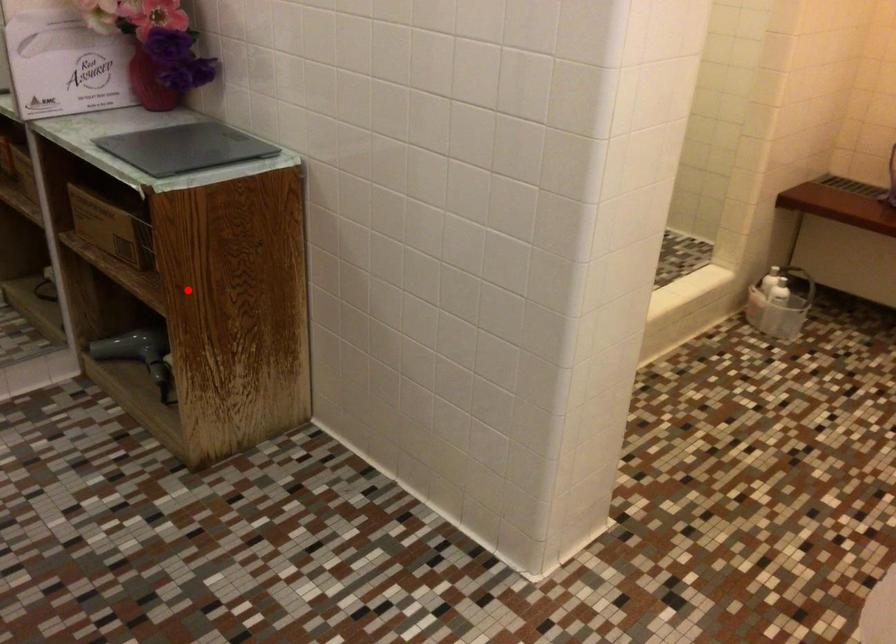
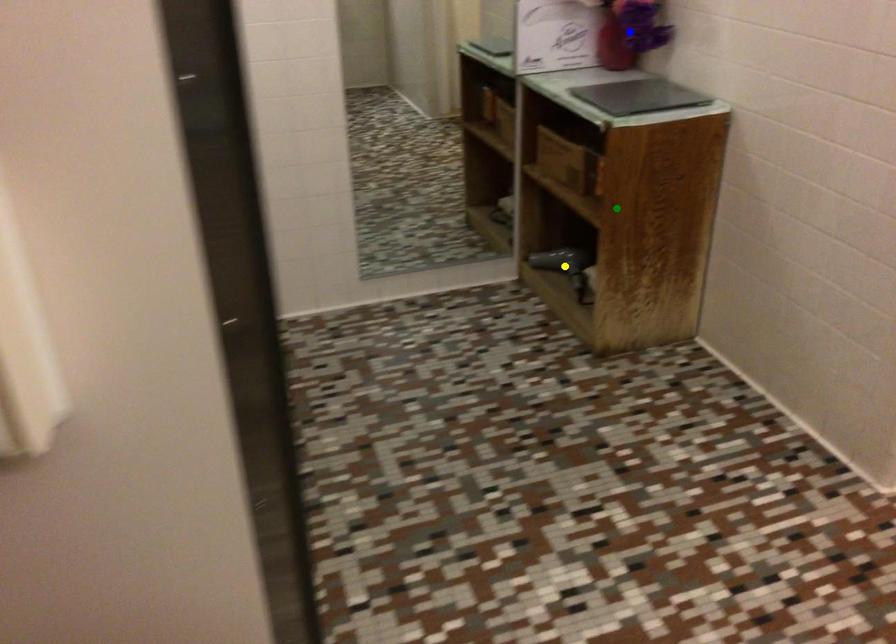
Question: I am providing you with two images of the same scene from different viewpoints. A red point is marked on the first image. You are given multiple points on the second image. In image 2, which mark is for the same physical point as the one in image 1?

Choices:
 (A) green point
 (B) yellow point
 (C) blue point

Answer: (A)